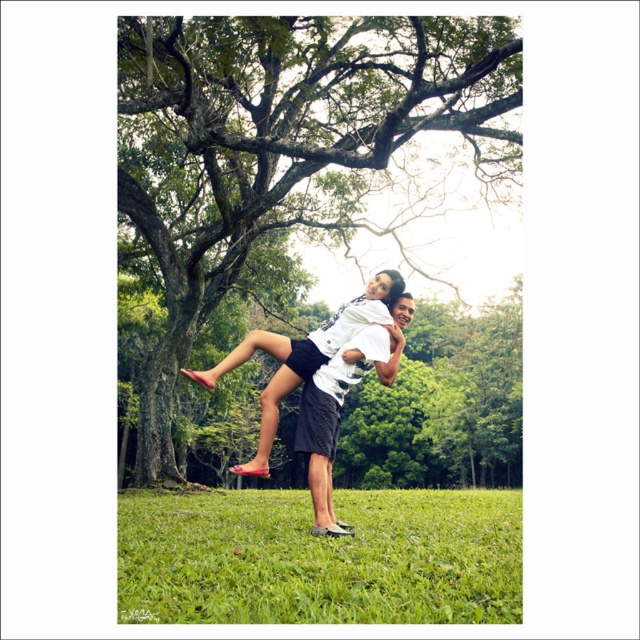
Which is in front, point (362, 61) or point (330, 406)?

Point (330, 406) is in front.

Between green leafy tree at center and white matte shorts at center, which one has less height?

With less height is white matte shorts at center.

Locate an element on the screen. green leafy tree at center is located at coordinates (280, 147).

Is green grass at lower center closer to the viewer compared to matte white shirt at center?

Yes, it is.

Can you confirm if green grass at lower center is shorter than matte white shirt at center?

No.

Is point (362, 502) in front of point (369, 280)?

No, (362, 502) is further to viewer.

Image resolution: width=640 pixels, height=640 pixels. What are the coordinates of `green grass at lower center` in the screenshot? It's located at (320, 557).

Between point (445, 67) and point (234, 540), which one is positioned in front?

Positioned in front is point (234, 540).

What do you see at coordinates (280, 147) in the screenshot? I see `green leafy tree at center` at bounding box center [280, 147].

This screenshot has height=640, width=640. I want to click on green leafy tree at center, so click(x=280, y=147).